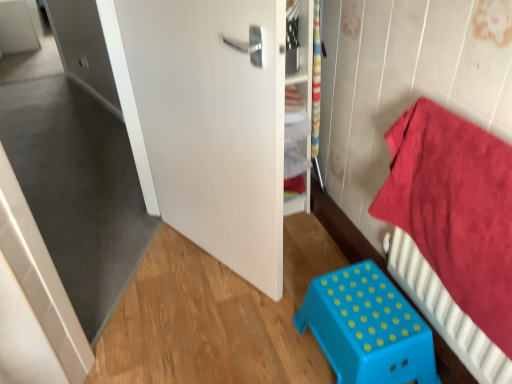
Question: From a real-world perspective, is white matte door at center physically below blue plastic stool at lower center?

Choices:
 (A) no
 (B) yes

Answer: (A)

Question: Is white matte door at center facing towards blue plastic stool at lower center?

Choices:
 (A) no
 (B) yes

Answer: (A)

Question: Considering the relative sizes of white matte door at center and blue plastic stool at lower center in the image provided, is white matte door at center shorter than blue plastic stool at lower center?

Choices:
 (A) yes
 (B) no

Answer: (B)

Question: Is white matte door at center directly adjacent to blue plastic stool at lower center?

Choices:
 (A) no
 (B) yes

Answer: (A)

Question: Is white matte door at center behind blue plastic stool at lower center?

Choices:
 (A) no
 (B) yes

Answer: (A)

Question: From a real-world perspective, is blue plastic stool at lower center positioned above or below red cotton towel at right?

Choices:
 (A) below
 (B) above

Answer: (A)

Question: Considering the relative positions of blue plastic stool at lower center and red cotton towel at right in the image provided, is blue plastic stool at lower center to the left or to the right of red cotton towel at right?

Choices:
 (A) left
 (B) right

Answer: (A)

Question: In the image, is blue plastic stool at lower center positioned in front of or behind red cotton towel at right?

Choices:
 (A) behind
 (B) front

Answer: (A)

Question: Is blue plastic stool at lower center spatially inside red cotton towel at right, or outside of it?

Choices:
 (A) inside
 (B) outside

Answer: (B)

Question: Is point (506, 208) positioned closer to the camera than point (269, 162)?

Choices:
 (A) farther
 (B) closer

Answer: (B)

Question: Is red cotton towel at right wider or thinner than white matte door at center?

Choices:
 (A) thin
 (B) wide

Answer: (A)

Question: Considering the relative positions of red cotton towel at right and white matte door at center in the image provided, is red cotton towel at right to the left or to the right of white matte door at center?

Choices:
 (A) right
 (B) left

Answer: (A)

Question: Is red cotton towel at right taller or shorter than white matte door at center?

Choices:
 (A) short
 (B) tall

Answer: (A)

Question: Looking at their shapes, would you say white matte door at center is wider or thinner than blue plastic stool at lower center?

Choices:
 (A) wide
 (B) thin

Answer: (B)

Question: Would you say white matte door at center is inside or outside blue plastic stool at lower center?

Choices:
 (A) inside
 (B) outside

Answer: (B)